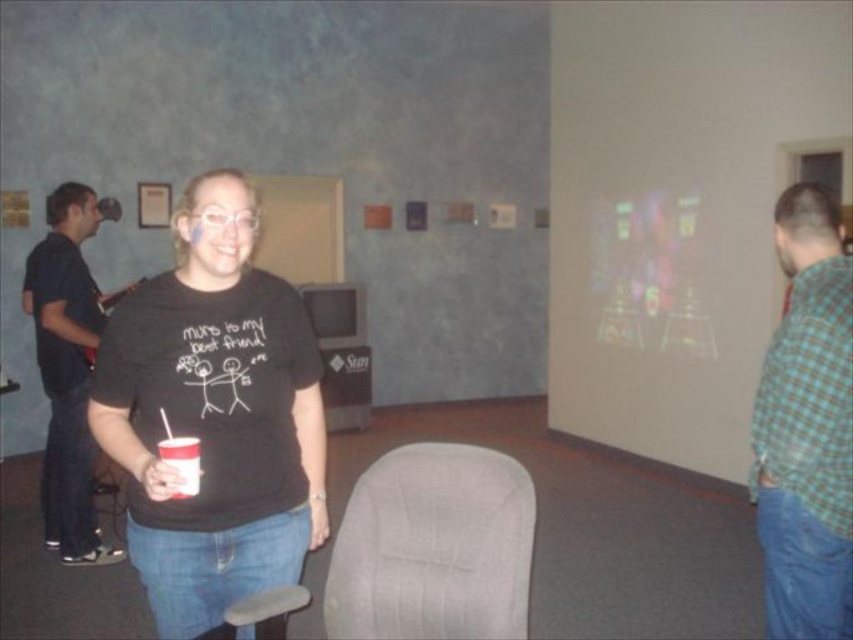
Question: Estimate the real-world distances between objects in this image. Which object is farther from the gray fabric swivel chair at center?

Choices:
 (A) white plastic cup at center
 (B) checkered fabric shirt at right

Answer: (B)

Question: Which of the following is the closest to the observer?

Choices:
 (A) (767, 632)
 (B) (33, 266)
 (C) (181, 476)
 (D) (500, 572)

Answer: (C)

Question: Does checkered fabric shirt at right have a greater width compared to white plastic cup at center?

Choices:
 (A) no
 (B) yes

Answer: (B)

Question: Is gray fabric swivel chair at center closer to camera compared to dark blue shirt at left?

Choices:
 (A) no
 (B) yes

Answer: (B)

Question: Is checkered fabric shirt at right below gray fabric swivel chair at center?

Choices:
 (A) no
 (B) yes

Answer: (A)

Question: Estimate the real-world distances between objects in this image. Which object is closer to the gray fabric swivel chair at center?

Choices:
 (A) dark blue shirt at left
 (B) checkered fabric shirt at right
 (C) white plastic cup at center

Answer: (C)